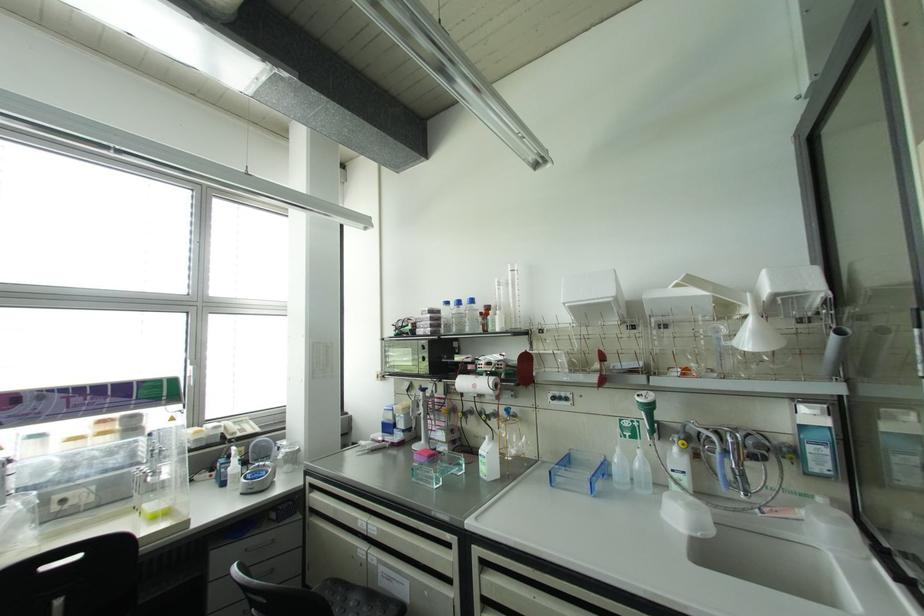
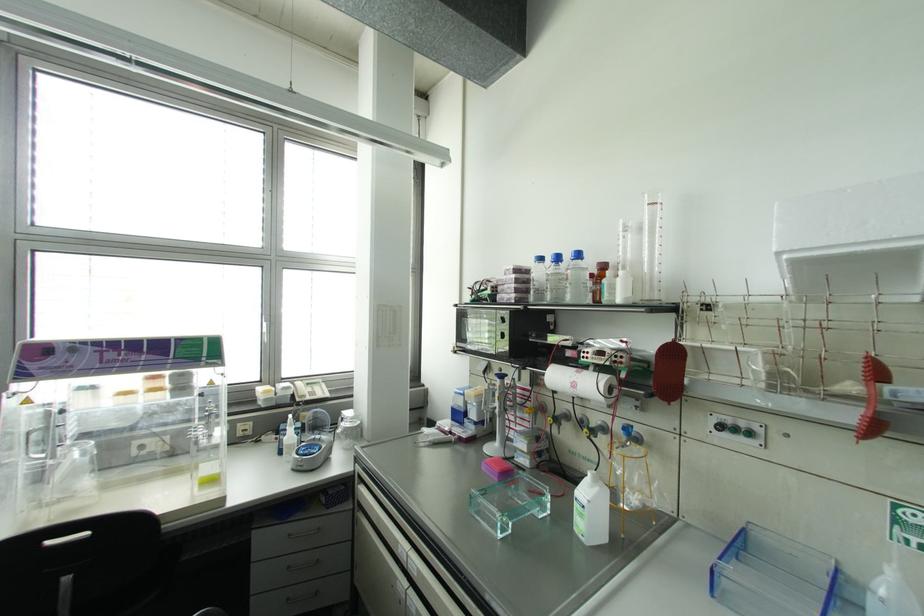
Question: How did the camera likely rotate?

Choices:
 (A) Left
 (B) Right
 (C) Up
 (D) Down

Answer: (A)